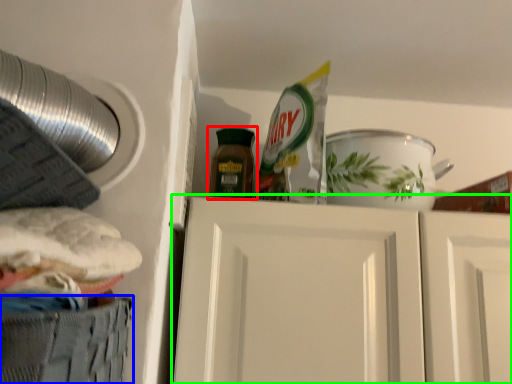
Question: Considering the real-world distances, which object is closest to bottle (highlighted by a red box)? cabinetry (highlighted by a blue box) or door (highlighted by a green box).

Choices:
 (A) cabinetry
 (B) door

Answer: (B)